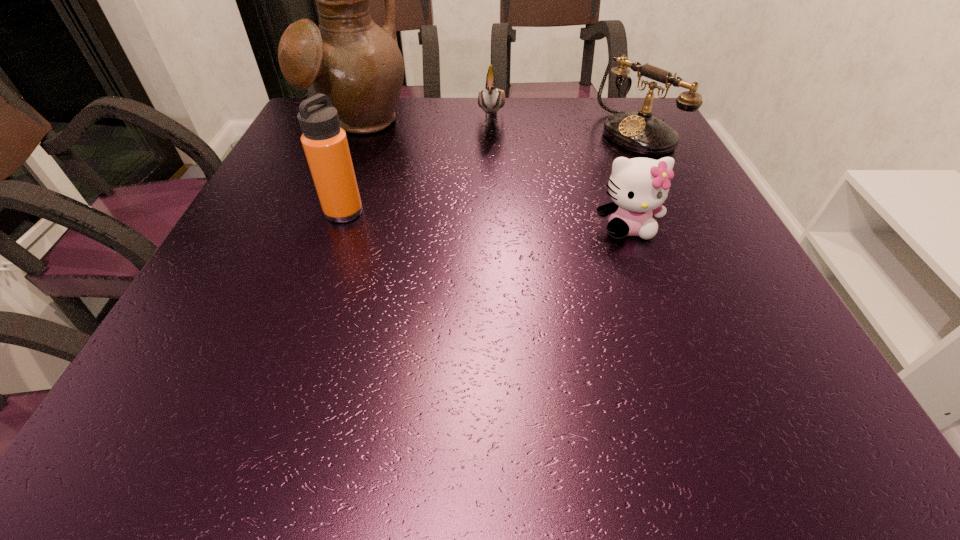
You are a GUI agent. You are given a task and a screenshot of the screen. Output one action in this format:
    pyautogui.click(x=<x>, y=<y>)
    Task: Click on the thermos bottle
    
    Given the screenshot: What is the action you would take?
    pyautogui.click(x=325, y=144)

This screenshot has width=960, height=540. I want to click on kitten, so click(x=638, y=186).

Identify the location of pitcher. The height and width of the screenshot is (540, 960). (349, 58).

This screenshot has width=960, height=540. What are the coordinates of `the third object from right to left` in the screenshot? It's located at (491, 99).

This screenshot has width=960, height=540. What are the coordinates of `telephone` in the screenshot? It's located at (640, 132).

This screenshot has width=960, height=540. I want to click on free space located on the right of the thermos bottle, so click(x=436, y=212).

Identify the location of free location located 0.150m on the front-facing side of the kitten. This screenshot has width=960, height=540. (655, 303).

Where is `vacant space situated at the spout of the pitcher`? Image resolution: width=960 pixels, height=540 pixels. vacant space situated at the spout of the pitcher is located at coordinates (399, 161).

The width and height of the screenshot is (960, 540). What are the coordinates of `free space located at the spout of the pitcher` in the screenshot? It's located at (436, 193).

Locate an element on the screen. Image resolution: width=960 pixels, height=540 pixels. vacant space situated at the spout of the pitcher is located at coordinates (452, 206).